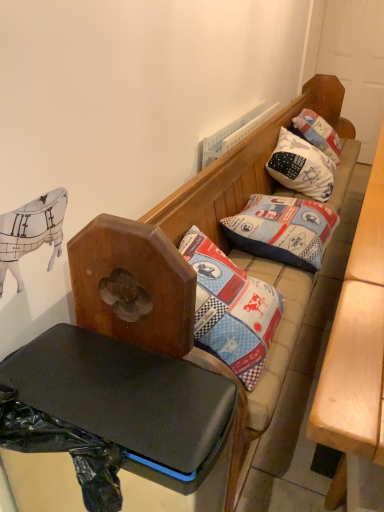
Question: From a real-world perspective, is black plastic table at lower left, which appears as the second table when viewed from the right, beneath patchwork fabric pillow at center, arranged as the 2th pillow when viewed from the back?

Choices:
 (A) no
 (B) yes

Answer: (B)

Question: Is black plastic table at lower left, the first table positioned from the left, to the right of patchwork fabric pillow at center, positioned as the 1th pillow in front-to-back order, from the viewer's perspective?

Choices:
 (A) yes
 (B) no

Answer: (B)

Question: From the image's perspective, is black plastic table at lower left, the first table positioned from the left, located beneath patchwork fabric pillow at center, positioned as the 1th pillow in front-to-back order?

Choices:
 (A) yes
 (B) no

Answer: (A)

Question: Would you say black plastic table at lower left, the first table positioned from the left, is a long distance from patchwork fabric pillow at center, positioned as the 1th pillow in front-to-back order?

Choices:
 (A) no
 (B) yes

Answer: (A)

Question: Can we say black plastic table at lower left, the first table positioned from the left, lies outside patchwork fabric pillow at center, positioned as the 1th pillow in front-to-back order?

Choices:
 (A) yes
 (B) no

Answer: (A)

Question: In the image, is patchwork fabric pillow at center, arranged as the 2th pillow when viewed from the back, positioned in front of or behind white cotton pillow at upper right, acting as the second pillow starting from the front?

Choices:
 (A) behind
 (B) front

Answer: (B)

Question: Considering the positions of patchwork fabric pillow at center, positioned as the 1th pillow in front-to-back order, and white cotton pillow at upper right, marked as the 1th pillow in a back-to-front arrangement, in the image, is patchwork fabric pillow at center, positioned as the 1th pillow in front-to-back order, bigger or smaller than white cotton pillow at upper right, marked as the 1th pillow in a back-to-front arrangement,?

Choices:
 (A) small
 (B) big

Answer: (A)

Question: In terms of height, does patchwork fabric pillow at center, positioned as the 1th pillow in front-to-back order, look taller or shorter compared to white cotton pillow at upper right, marked as the 1th pillow in a back-to-front arrangement?

Choices:
 (A) tall
 (B) short

Answer: (B)

Question: Is patchwork fabric pillow at center, positioned as the 1th pillow in front-to-back order, inside or outside of white cotton pillow at upper right, acting as the second pillow starting from the front?

Choices:
 (A) outside
 (B) inside

Answer: (A)

Question: Is light brown wooden table at right, the 2th table positioned from the left, in front of or behind patchwork fabric pillow at center, positioned as the 1th pillow in front-to-back order, in the image?

Choices:
 (A) front
 (B) behind

Answer: (A)

Question: Considering the positions of light brown wooden table at right, the 1th table from the right, and patchwork fabric pillow at center, positioned as the 1th pillow in front-to-back order, in the image, is light brown wooden table at right, the 1th table from the right, taller or shorter than patchwork fabric pillow at center, positioned as the 1th pillow in front-to-back order,?

Choices:
 (A) tall
 (B) short

Answer: (A)

Question: Considering the positions of light brown wooden table at right, the 1th table from the right, and patchwork fabric pillow at center, arranged as the 2th pillow when viewed from the back, in the image, is light brown wooden table at right, the 1th table from the right, bigger or smaller than patchwork fabric pillow at center, arranged as the 2th pillow when viewed from the back,?

Choices:
 (A) small
 (B) big

Answer: (B)

Question: Choose the correct answer: Is light brown wooden table at right, the 1th table from the right, inside patchwork fabric pillow at center, arranged as the 2th pillow when viewed from the back, or outside it?

Choices:
 (A) outside
 (B) inside

Answer: (A)

Question: Looking at the image, does black plastic table at lower left, the first table positioned from the left, seem bigger or smaller compared to patchwork fabric pillow at center, positioned as the 1th pillow in front-to-back order?

Choices:
 (A) small
 (B) big

Answer: (B)

Question: Considering the positions of black plastic table at lower left, the first table positioned from the left, and patchwork fabric pillow at center, arranged as the 2th pillow when viewed from the back, in the image, is black plastic table at lower left, the first table positioned from the left, wider or thinner than patchwork fabric pillow at center, arranged as the 2th pillow when viewed from the back,?

Choices:
 (A) wide
 (B) thin

Answer: (B)